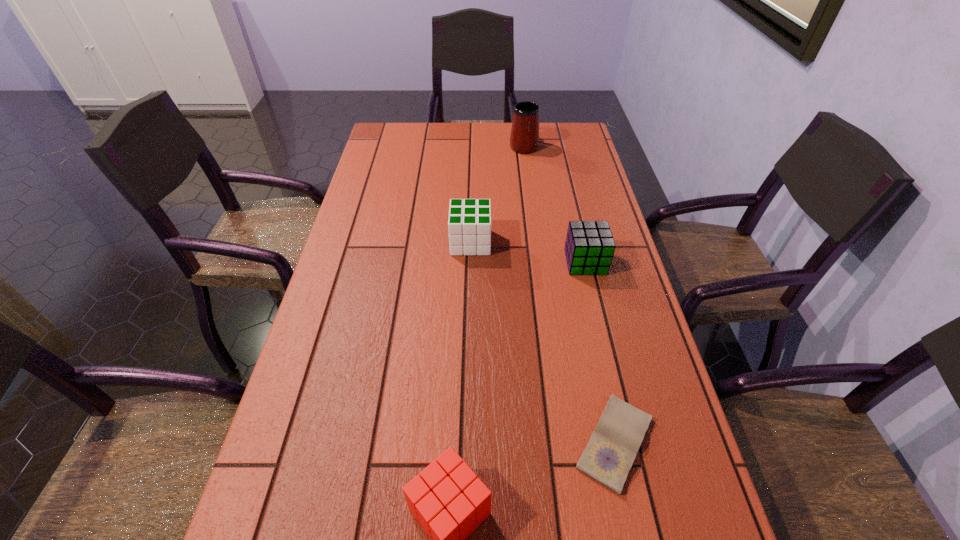
Find the location of a particular element. The image size is (960, 540). mug is located at coordinates (524, 138).

At what (x,y) coordinates should I click in order to perform the action: click on the tallest object. Please return your answer as a coordinate pair (x, y). Looking at the image, I should click on (524, 138).

I want to click on the rightmost cube, so click(589, 248).

Identify the location of diary. (608, 457).

This screenshot has width=960, height=540. I want to click on vacant area situated 0.060m on the side of the mug with the handle, so tap(521, 127).

The width and height of the screenshot is (960, 540). I want to click on free location located on the side of the mug with the handle, so click(x=520, y=123).

Identify the location of free space located on the front of the rightmost cube. (618, 402).

Find the location of a particular element. free space located on the back of the diary is located at coordinates (595, 353).

Where is `object situated at the far edge`? This screenshot has height=540, width=960. object situated at the far edge is located at coordinates (524, 138).

The image size is (960, 540). In order to click on cube that is at the right edge in this screenshot , I will do `click(589, 248)`.